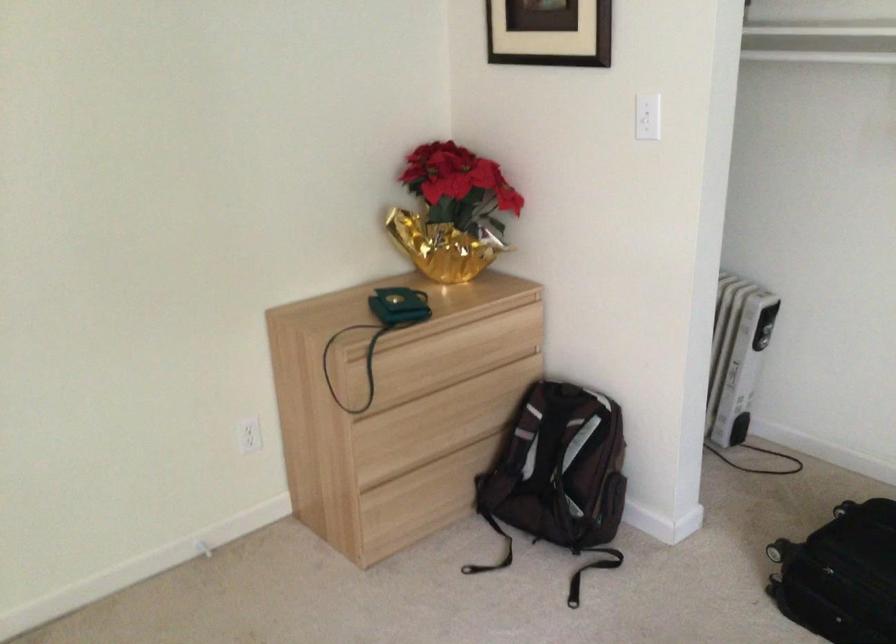
Describe the element at coordinates (761, 339) in the screenshot. I see `the heater control dial` at that location.